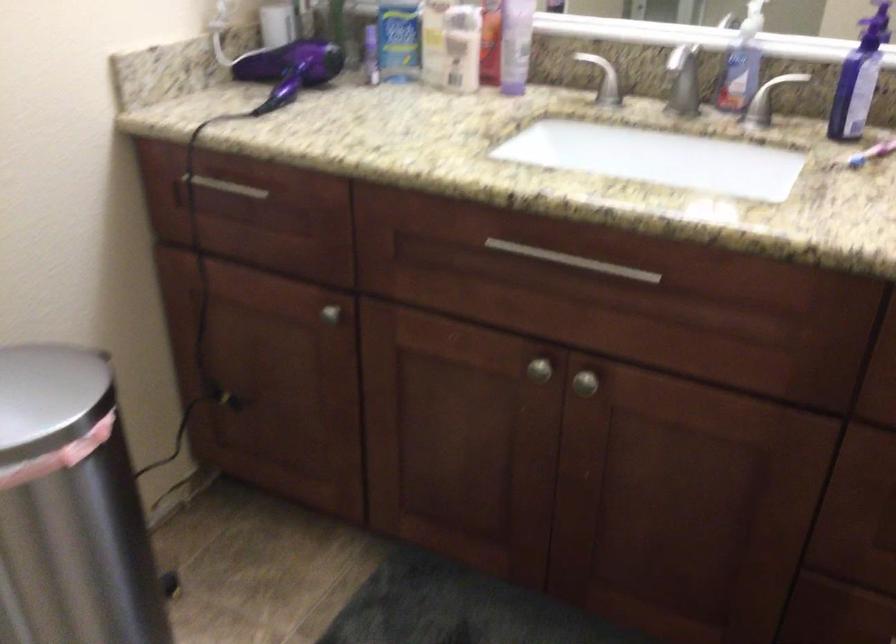
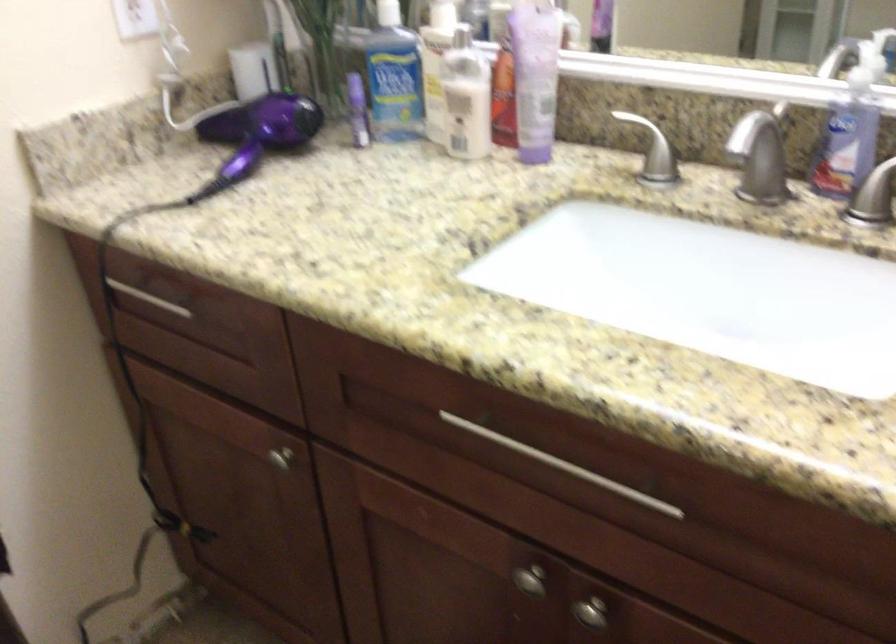
Find the pixel in the second image that matches point 739,79 in the first image.

(846, 145)